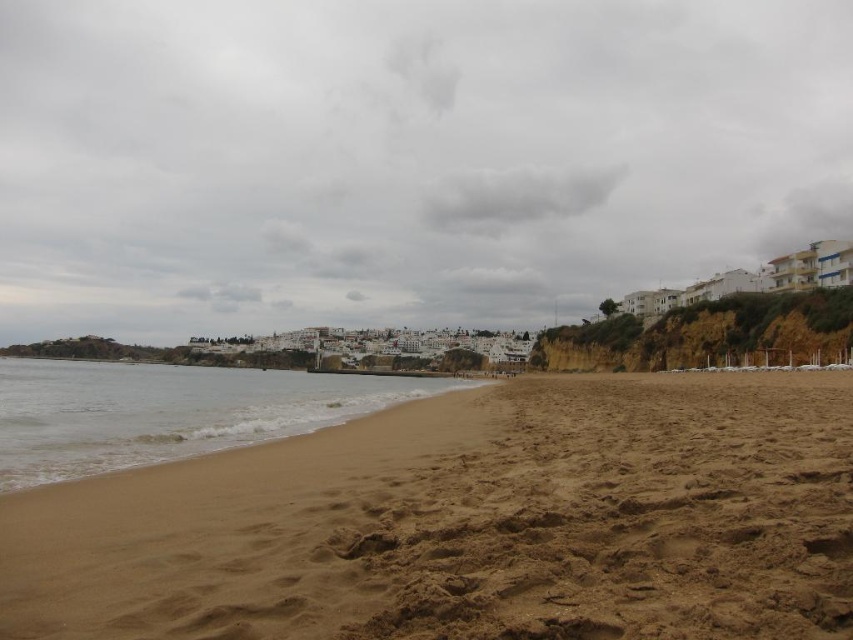
Which is in front, point (624, 509) or point (202, 451)?

Positioned in front is point (624, 509).

Between brown sandy beach at lower left and brown sand at lower left, which one is positioned higher?

Positioned higher is brown sandy beach at lower left.

Measure the distance between point (28,516) and camera.

Point (28,516) is 161.77 feet from camera.

The width and height of the screenshot is (853, 640). I want to click on brown sandy beach at lower left, so click(x=469, y=522).

Is cloudy sky at upper center to the left of brown sandy beach at lower left from the viewer's perspective?

Correct, you'll find cloudy sky at upper center to the left of brown sandy beach at lower left.

Which is behind, point (524, 116) or point (604, 513)?

The point (524, 116) is behind.

Image resolution: width=853 pixels, height=640 pixels. Identify the location of cloudy sky at upper center. (404, 157).

Does cloudy sky at upper center appear under brown sand at lower left?

No, cloudy sky at upper center is not below brown sand at lower left.

The image size is (853, 640). In order to click on cloudy sky at upper center in this screenshot , I will do `click(404, 157)`.